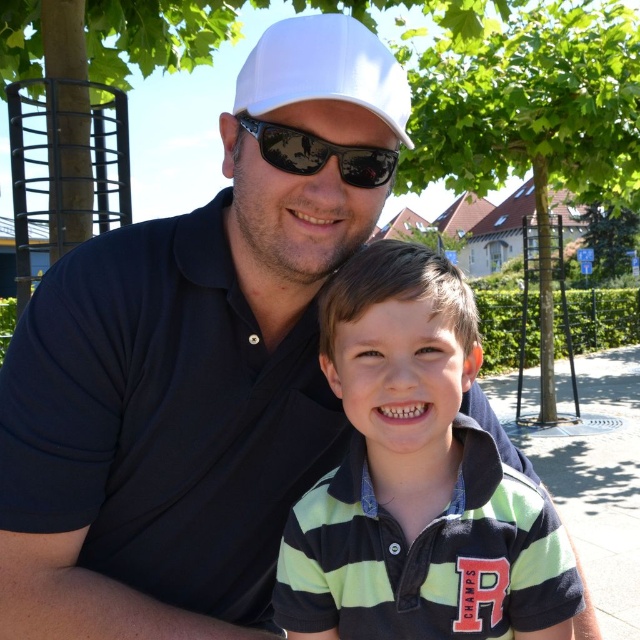
You are standing in the scene and want to move from point A to point B. Point A is at coordinates point (179, 372) and point B is at coordinates point (364, 387). Which point is closer to you?

Point (179, 372) is closer to you because it is further to the viewer than point (364, 387).

You are a photographer trying to capture the perfect shot of the two people in the scene. You want to ensure that both the white matte cap at upper center and the black reflective sunglasses at center are clearly visible in your photo. Considering their positions, which object should you focus on first to ensure clarity, and why?

The white matte cap at upper center should be focused on first because it has a greater height compared to the black reflective sunglasses at center, making it more prominent in the frame.